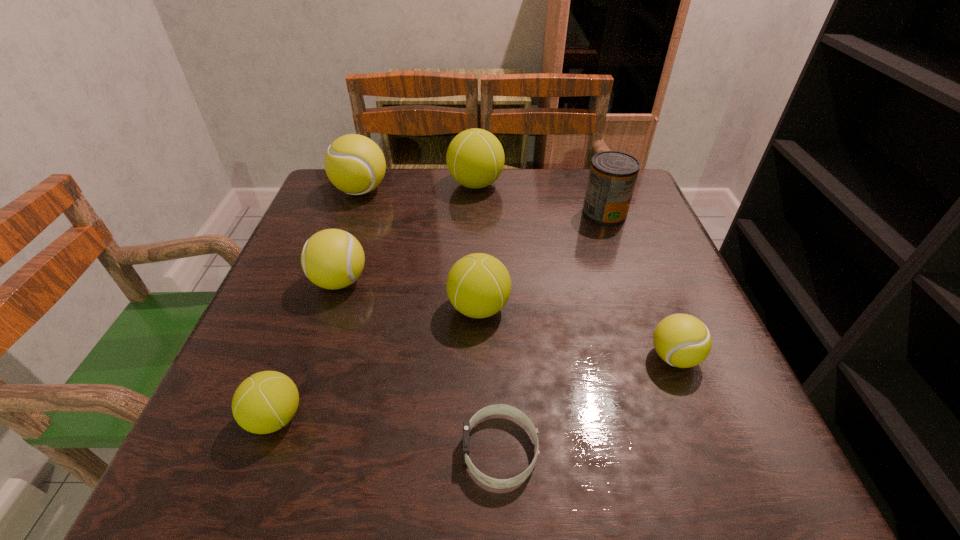
In the image, there is a desktop. Identify the location of vacant space at the left edge. (278, 347).

What are the coordinates of `vacant space at the right edge` in the screenshot? It's located at (687, 429).

Find the location of `free space at the far left corner of the desktop`. free space at the far left corner of the desktop is located at coordinates (317, 193).

In the image, there is a desktop. Where is `vacant space at the near left corner`? The height and width of the screenshot is (540, 960). vacant space at the near left corner is located at coordinates (257, 442).

The image size is (960, 540). What are the coordinates of `vacant area that lies between the nearest yellow tennis ball and the second nearest yellow tennis ball` in the screenshot? It's located at tap(507, 319).

I want to click on free spot between the second biggest yellow tennis ball and the farthest green tennis ball, so click(408, 233).

This screenshot has width=960, height=540. What are the coordinates of `vacant space in between the smallest green tennis ball and the shortest object` in the screenshot? It's located at (388, 434).

You are a GUI agent. You are given a task and a screenshot of the screen. Output one action in this format:
    pyautogui.click(x=<x>, y=<y>)
    Task: Click on the free space between the biggest yellow tennis ball and the biggest green tennis ball
    The width and height of the screenshot is (960, 540).
    Given the screenshot: What is the action you would take?
    pyautogui.click(x=419, y=187)

The image size is (960, 540). What are the coordinates of `free space between the leftmost green tennis ball and the second smallest green tennis ball` in the screenshot? It's located at (377, 363).

The height and width of the screenshot is (540, 960). In order to click on free space between the biggest yellow tennis ball and the wristband in this screenshot , I will do `click(431, 321)`.